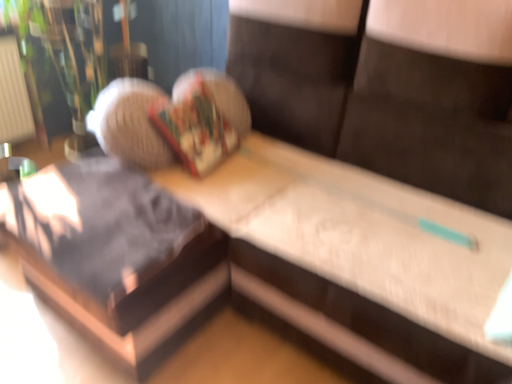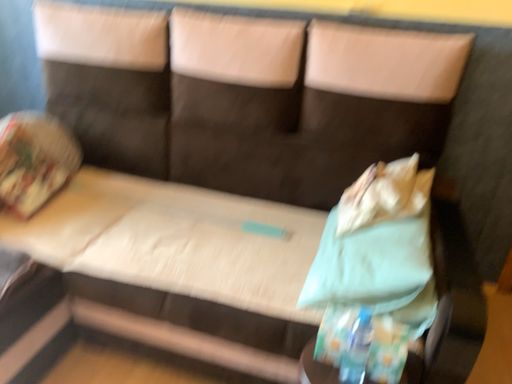
Question: How did the camera likely rotate when shooting the video?

Choices:
 (A) rotated right
 (B) rotated left

Answer: (A)